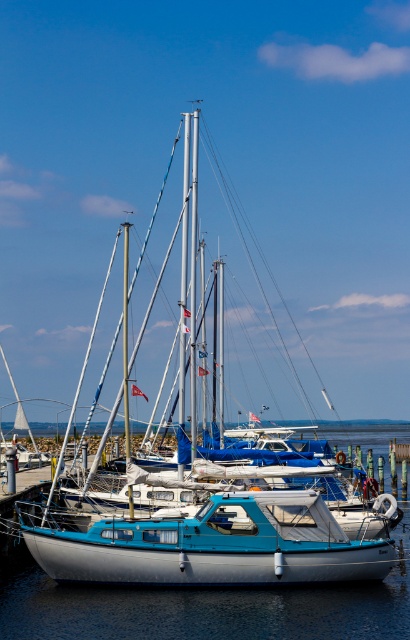
Question: Is blue matte sailboat at center to the left of blue metallic water at center from the viewer's perspective?

Choices:
 (A) no
 (B) yes

Answer: (B)

Question: Which of the following is the farthest from the observer?

Choices:
 (A) (266, 554)
 (B) (38, 592)

Answer: (B)

Question: Among these objects, which one is nearest to the camera?

Choices:
 (A) teal glossy sailboat at center
 (B) blue metallic water at center
 (C) blue matte sailboat at center

Answer: (B)

Question: Is blue matte sailboat at center thinner than blue metallic water at center?

Choices:
 (A) yes
 (B) no

Answer: (A)

Question: Does blue matte sailboat at center have a lesser width compared to teal glossy sailboat at center?

Choices:
 (A) no
 (B) yes

Answer: (A)

Question: Which is farther from the blue matte sailboat at center?

Choices:
 (A) teal glossy sailboat at center
 (B) blue metallic water at center

Answer: (A)